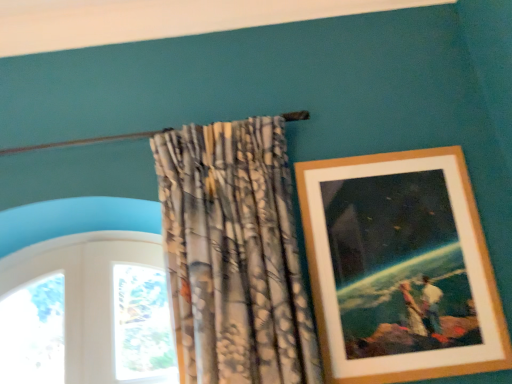
Question: Is wooden picture frame at upper right to the left or to the right of textured fabric curtain at upper center in the image?

Choices:
 (A) right
 (B) left

Answer: (A)

Question: Is wooden picture frame at upper right situated inside textured fabric curtain at upper center or outside?

Choices:
 (A) inside
 (B) outside

Answer: (B)

Question: In terms of height, does wooden picture frame at upper right look taller or shorter compared to textured fabric curtain at upper center?

Choices:
 (A) tall
 (B) short

Answer: (B)

Question: Is textured fabric curtain at upper center wider or thinner than wooden picture frame at upper right?

Choices:
 (A) wide
 (B) thin

Answer: (A)

Question: Would you say textured fabric curtain at upper center is inside or outside wooden picture frame at upper right?

Choices:
 (A) inside
 (B) outside

Answer: (B)

Question: Is textured fabric curtain at upper center taller or shorter than wooden picture frame at upper right?

Choices:
 (A) tall
 (B) short

Answer: (A)

Question: Considering the positions of textured fabric curtain at upper center and wooden picture frame at upper right in the image, is textured fabric curtain at upper center bigger or smaller than wooden picture frame at upper right?

Choices:
 (A) small
 (B) big

Answer: (B)